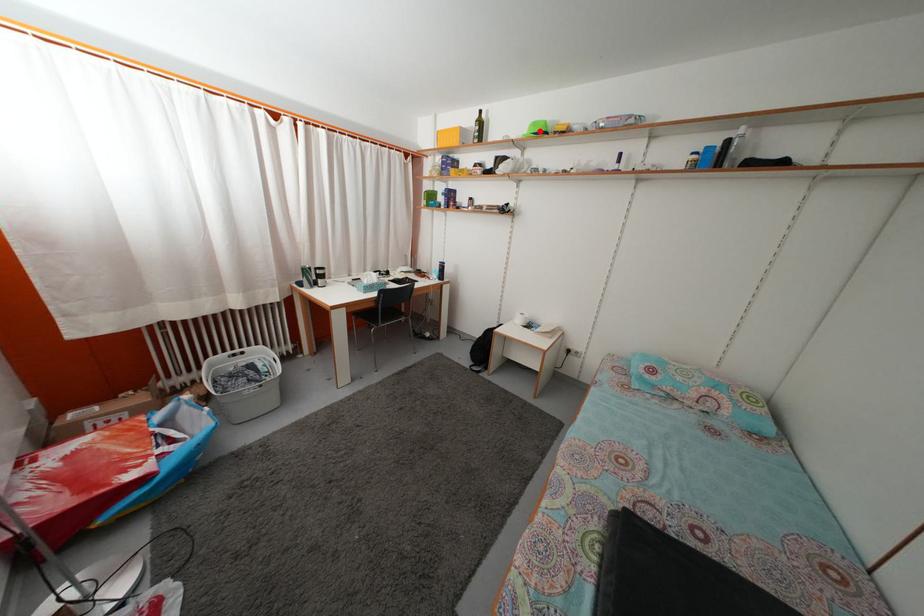
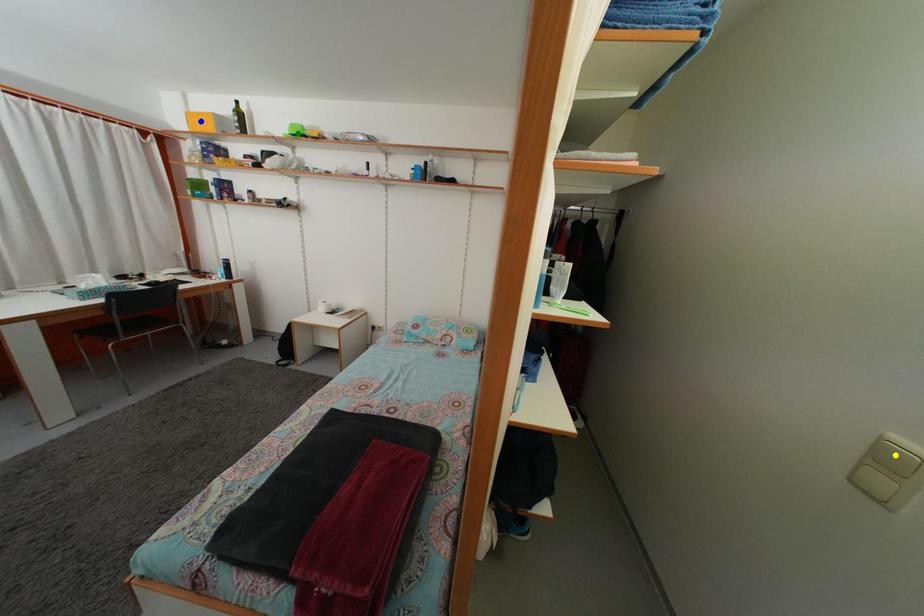
Question: I am providing you with two images of the same scene from different viewpoints. A red point is marked on the first image. You are given multiple points on the second image. In image 2, which mark is for the same physical point as the one in image 1?

Choices:
 (A) yellow point
 (B) green point
 (C) blue point

Answer: (B)